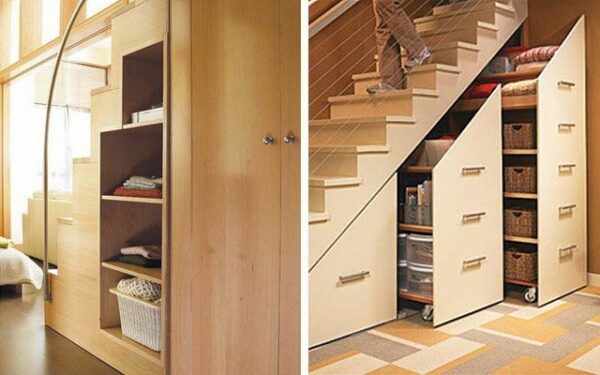
Identify the location of bed. This screenshot has height=375, width=600. (13, 267).